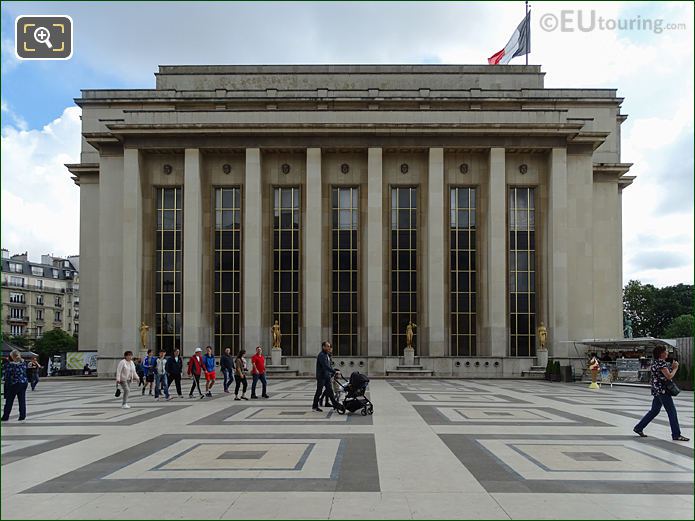
Identify the location of decorative tile. (254, 456).